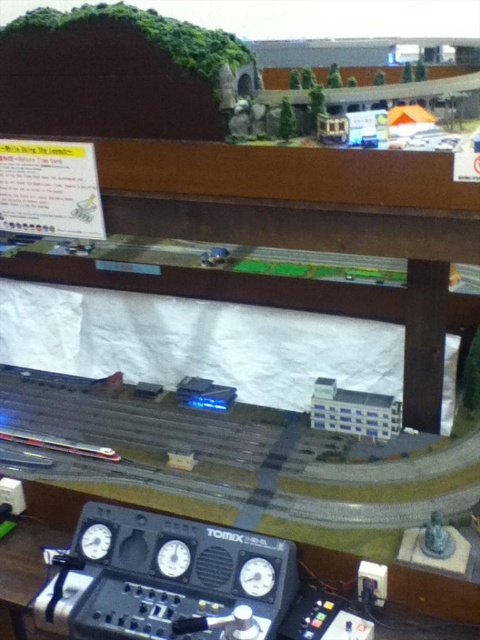
You are setting up a model railway and need to place two matte black gauges. According to the image, where should the matte black gauge at center be placed relative to the matte black gauge at lower left?

The matte black gauge at center should be positioned under the matte black gauge at lower left as per the description.

You are standing in front of the model railway setup and want to place a small toy car that is 1.5 meters long on the floor between you and the white plastic building at center. Will the toy car fit entirely between you and the building?

The distance between you and the white plastic building at center is 1.45 meters, which is shorter than the toy car length of 1.5 meters. Therefore, the toy car will not fit entirely between you and the building.

You are setting up a model railway display and need to ensure that the white plastic building at center and the matte black gauge at center are positioned correctly. Based on the provided information, which object should be placed first to accommodate their sizes?

The white plastic building at center should be placed first because it might be wider than the matte black gauge at center, ensuring there is enough space for both objects in the layout.